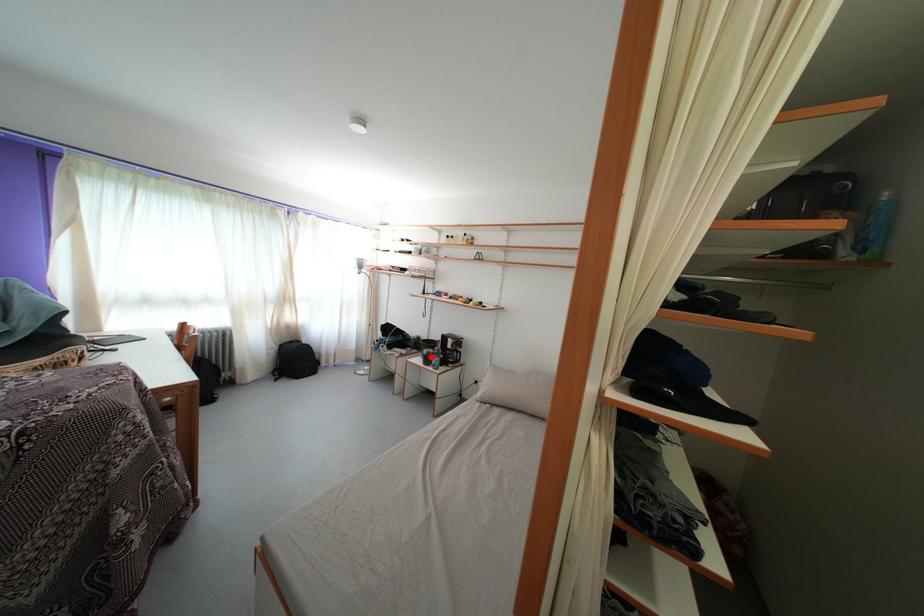
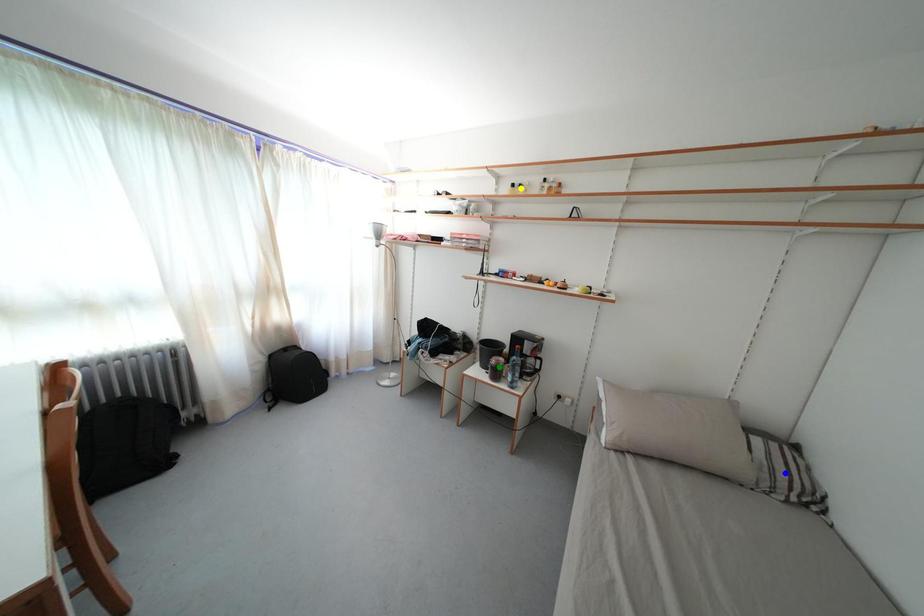
Question: I am providing you with two images of the same scene from different viewpoints. A red point is marked on the first image. You are given multiple points on the second image. Which spot in image 2 lines up with the point in image 1?

Choices:
 (A) green point
 (B) blue point
 (C) yellow point

Answer: (A)